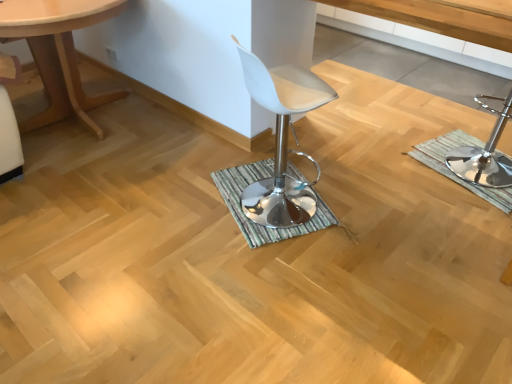
Image resolution: width=512 pixels, height=384 pixels. Find the location of `free point above green striped bath mat at right, the first bath mat viewed from the right (from a real-world perspective)`. free point above green striped bath mat at right, the first bath mat viewed from the right (from a real-world perspective) is located at coordinates click(x=473, y=163).